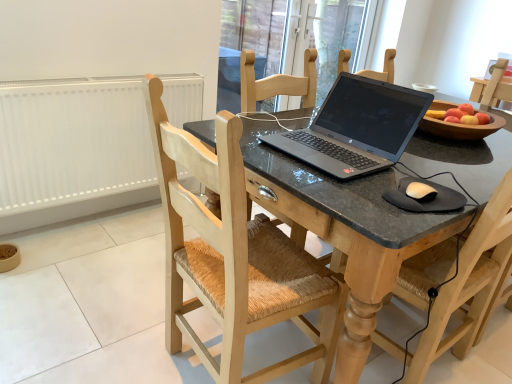
At what (x,y) coordinates should I click in order to perform the action: click on free space in front of slate gray laptop at center. Please return your answer as a coordinate pair (x, y). Image resolution: width=512 pixels, height=384 pixels. Looking at the image, I should click on (351, 193).